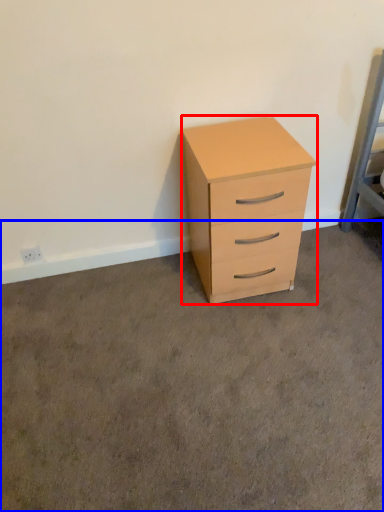
Question: Among these objects, which one is farthest to the camera, chest of drawers (highlighted by a red box) or concrete (highlighted by a blue box)?

Choices:
 (A) chest of drawers
 (B) concrete

Answer: (A)